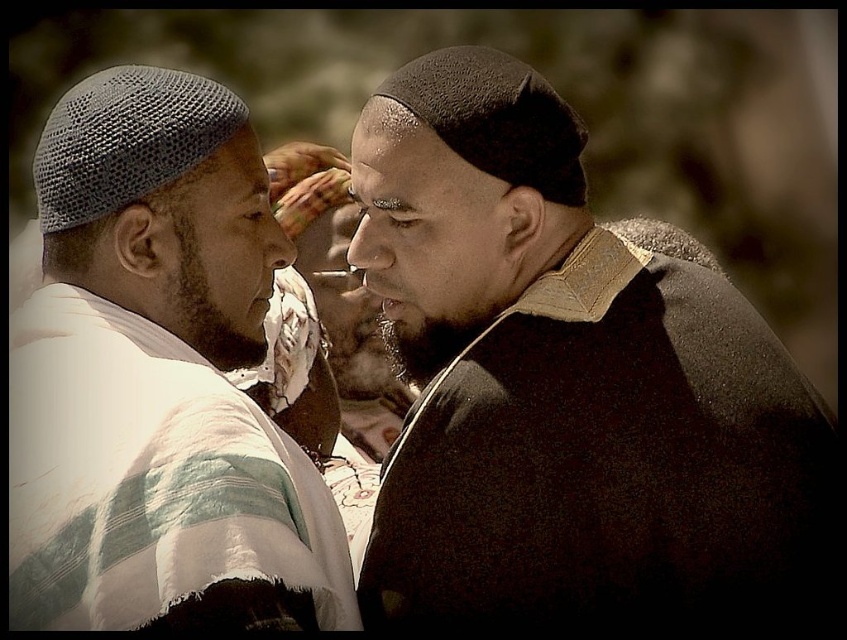
Can you confirm if white striped fabric at left is shorter than smooth brown leather jacket at center?

No, white striped fabric at left is not shorter than smooth brown leather jacket at center.

How distant is white striped fabric at left from smooth brown leather jacket at center?

white striped fabric at left is 31.19 feet from smooth brown leather jacket at center.

Is point (58, 512) positioned in front of point (300, 173)?

Yes, it is.

The image size is (847, 640). I want to click on white striped fabric at left, so click(x=154, y=371).

Which is behind, point (790, 525) or point (342, 353)?

The point (342, 353) is behind.

Can you confirm if black fuzzy hat at upper center is positioned to the left of smooth brown leather jacket at center?

No, black fuzzy hat at upper center is not to the left of smooth brown leather jacket at center.

What do you see at coordinates (562, 380) in the screenshot? This screenshot has height=640, width=847. I see `black fuzzy hat at upper center` at bounding box center [562, 380].

Find the location of a particular element. This screenshot has height=640, width=847. black fuzzy hat at upper center is located at coordinates 562,380.

Can you confirm if black fuzzy hat at upper center is positioned to the left of white striped fabric at left?

In fact, black fuzzy hat at upper center is to the right of white striped fabric at left.

In the scene shown: How much distance is there between black fuzzy hat at upper center and white striped fabric at left?

4.95 feet

Looking at this image, who is more distant from viewer, (646, 512) or (148, 275)?

The point (148, 275) is behind.

Where is `black fuzzy hat at upper center`? This screenshot has height=640, width=847. black fuzzy hat at upper center is located at coordinates (562, 380).